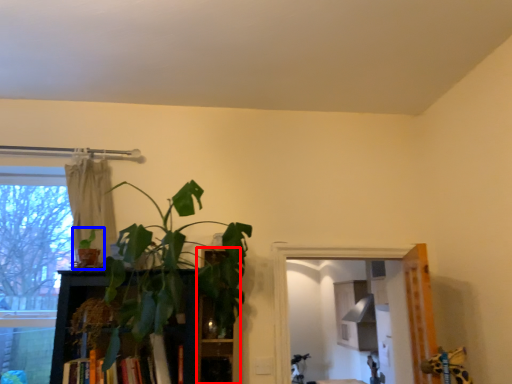
Question: Which object appears closest to the camera in this image, shelf (highlighted by a red box) or houseplant (highlighted by a blue box)?

Choices:
 (A) shelf
 (B) houseplant

Answer: (B)